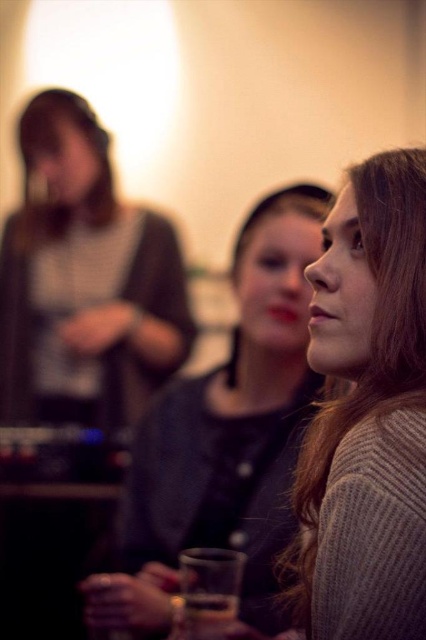
You are organizing a clothing display and need to arrange the knit sweater at center and the smooth gray sweater at center. According to the image, which sweater should be placed on top?

The knit sweater at center should be placed on top since it is positioned over the smooth gray sweater at center in the image.

You are at a social event and see the knit sweater at center and the matte black cup at lower center on a table. Can you tell me which object takes up more space on the table?

The knit sweater at center is larger in size than the matte black cup at lower center, so it takes up more space on the table.